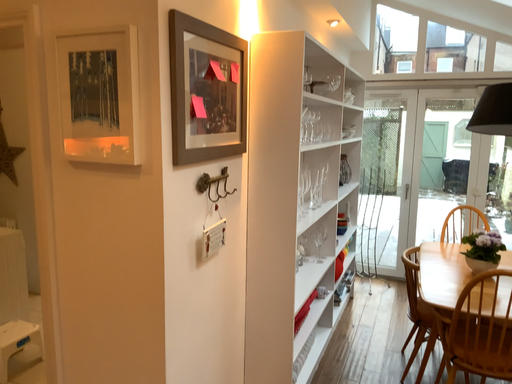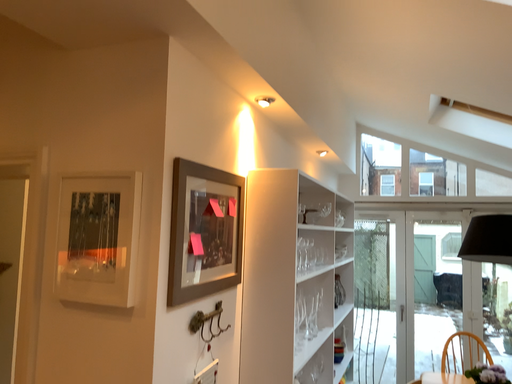
Question: How did the camera likely rotate when shooting the video?

Choices:
 (A) rotated upward
 (B) rotated downward

Answer: (A)